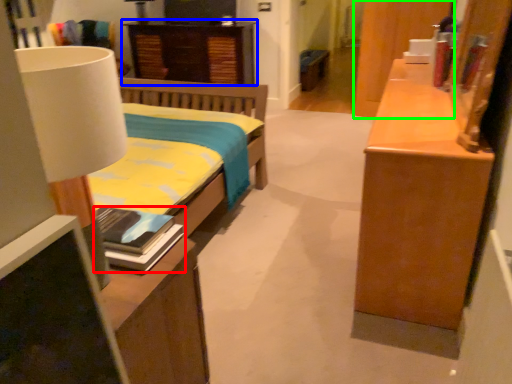
Question: Which object is the farthest from book (highlighted by a red box)? Choose among these: nightstand (highlighted by a blue box) or cabinetry (highlighted by a green box).

Choices:
 (A) nightstand
 (B) cabinetry

Answer: (A)